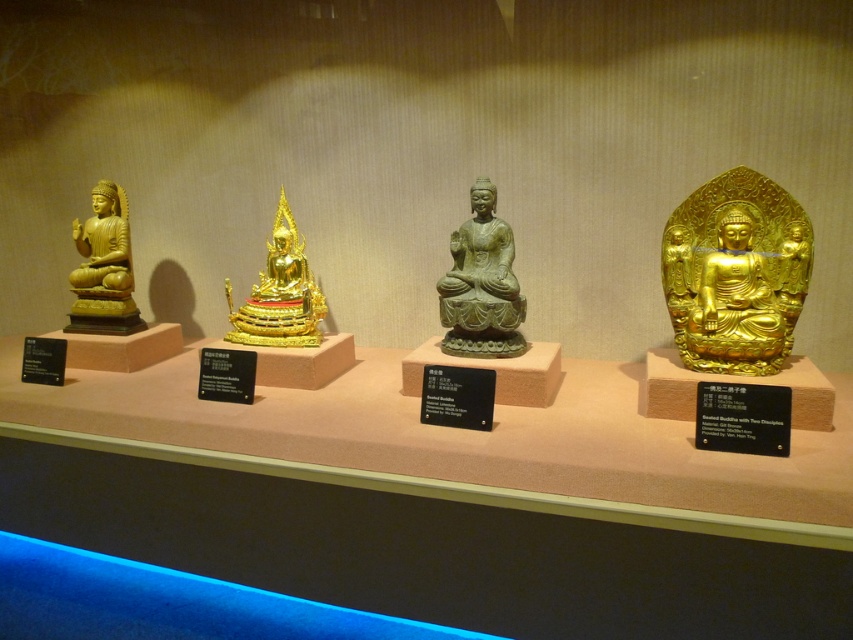
Between point (477, 314) and point (294, 228), which one is positioned behind?

Positioned behind is point (294, 228).

Does point (485, 326) lie in front of point (268, 253)?

That is True.

Between point (459, 344) and point (317, 328), which one is positioned in front?

Point (459, 344) is more forward.

Identify the location of green stone buddha at center. This screenshot has height=640, width=853. (480, 284).

Who is more forward, (445, 317) or (83, 252)?

Point (445, 317)

From the picture: Does green stone buddha at center have a smaller size compared to gold polished buddha at left?

Indeed, green stone buddha at center has a smaller size compared to gold polished buddha at left.

At what (x,y) coordinates should I click in order to perform the action: click on green stone buddha at center. Please return your answer as a coordinate pair (x, y). This screenshot has height=640, width=853. Looking at the image, I should click on (480, 284).

This screenshot has width=853, height=640. I want to click on green stone buddha at center, so click(480, 284).

Is gold polished buddha at left bigger than gold polished buddha at center?

No, gold polished buddha at left is not bigger than gold polished buddha at center.

Which of these two, gold polished buddha at left or gold polished buddha at center, stands shorter?

gold polished buddha at center

Describe the element at coordinates (103, 268) in the screenshot. I see `gold polished buddha at left` at that location.

Locate an element on the screen. This screenshot has height=640, width=853. gold polished buddha at left is located at coordinates (103, 268).